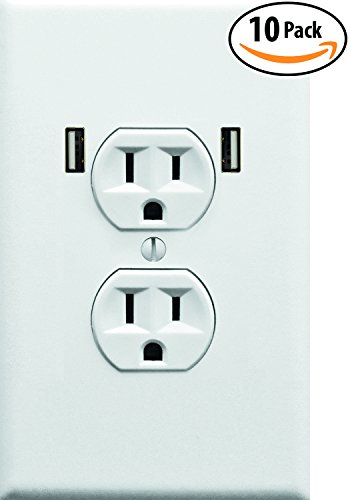
Locate an element on the screen. outlet is located at coordinates pos(186,242).